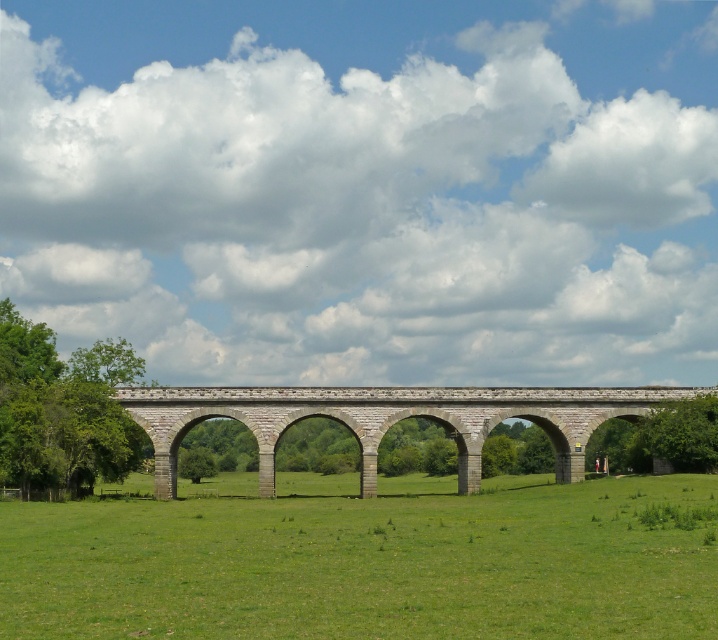
Is green grassy field at center shorter than green leafy tree at center?

Yes.

Is green grassy field at center bigger than green leafy tree at center?

Indeed, green grassy field at center has a larger size compared to green leafy tree at center.

Who is more distant from viewer, (587,586) or (701,417)?

The point (701,417) is more distant.

Identify the location of green grassy field at center. (365, 563).

Does point (136, 406) lie in front of point (111, 449)?

No, (136, 406) is behind (111, 449).

Based on the photo, is gray stone bridge at center bigger than green leafy tree at left?

Actually, gray stone bridge at center might be smaller than green leafy tree at left.

Is point (258, 412) closer to viewer compared to point (24, 349)?

Yes.

Where is `gray stone bridge at center`? The height and width of the screenshot is (640, 718). gray stone bridge at center is located at coordinates (386, 419).

Looking at this image, can you confirm if green grassy field at center is bigger than green leafy tree at left?

No, green grassy field at center is not bigger than green leafy tree at left.

The image size is (718, 640). Identify the location of green grassy field at center. (365, 563).

In order to click on green grassy field at center in this screenshot , I will do `click(365, 563)`.